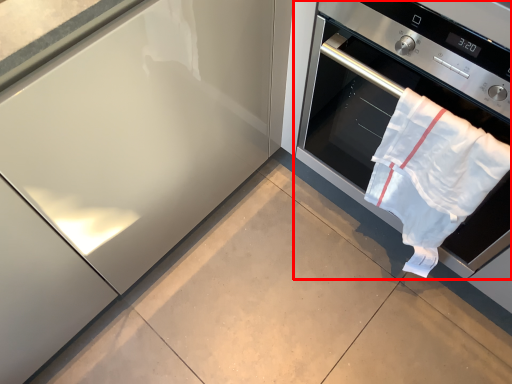
Question: Observing the image, what is the correct spatial positioning of home appliance (annotated by the red box) in reference to beach towel?

Choices:
 (A) right
 (B) left

Answer: (A)